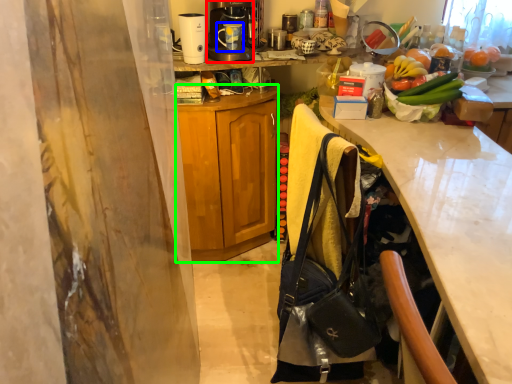
Question: Which object is positioned farthest from coffee maker (highlighted by a red box)? Select from coffee cup (highlighted by a blue box) and cabinetry (highlighted by a green box).

Choices:
 (A) coffee cup
 (B) cabinetry

Answer: (B)